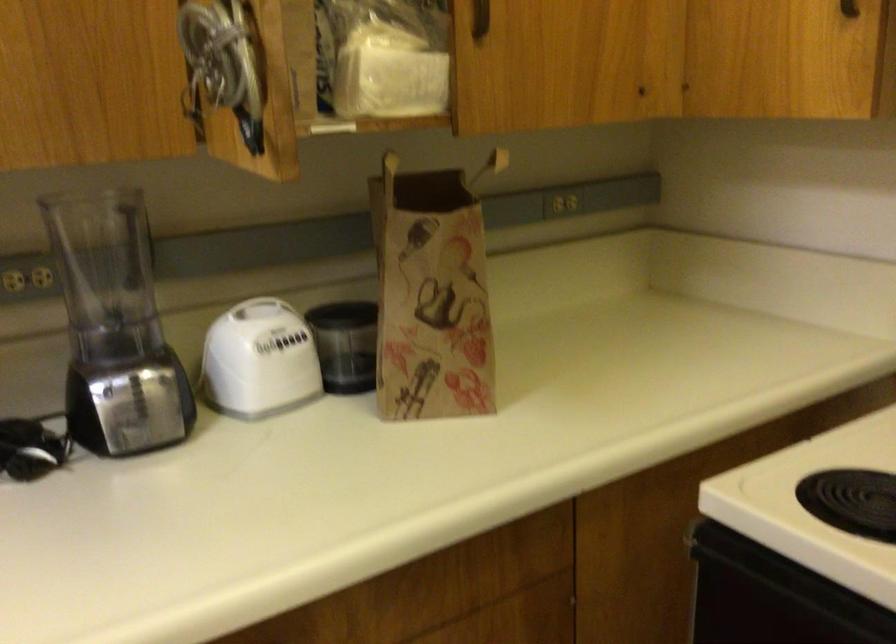
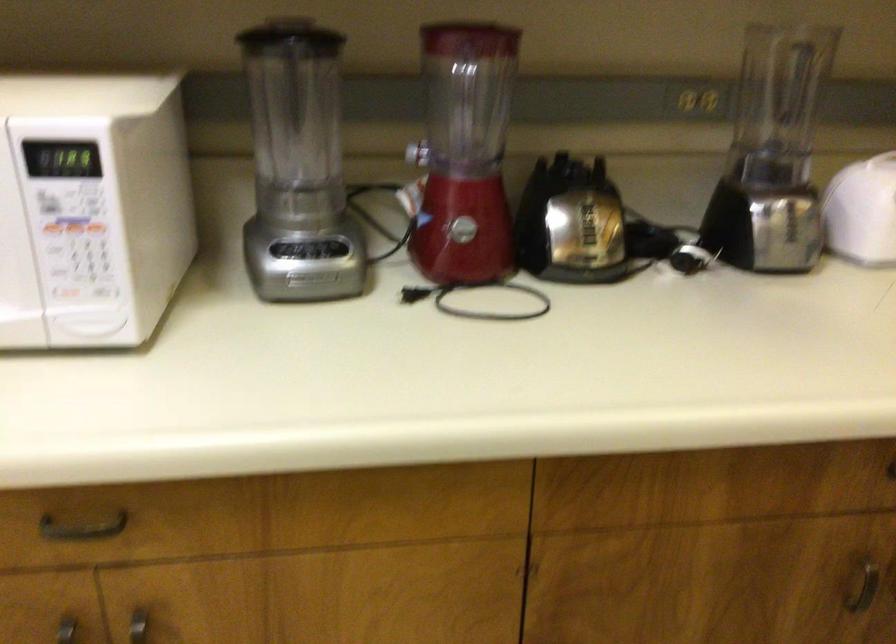
What movement of the cameraman would produce the second image?

The cameraman moved toward left, backward.